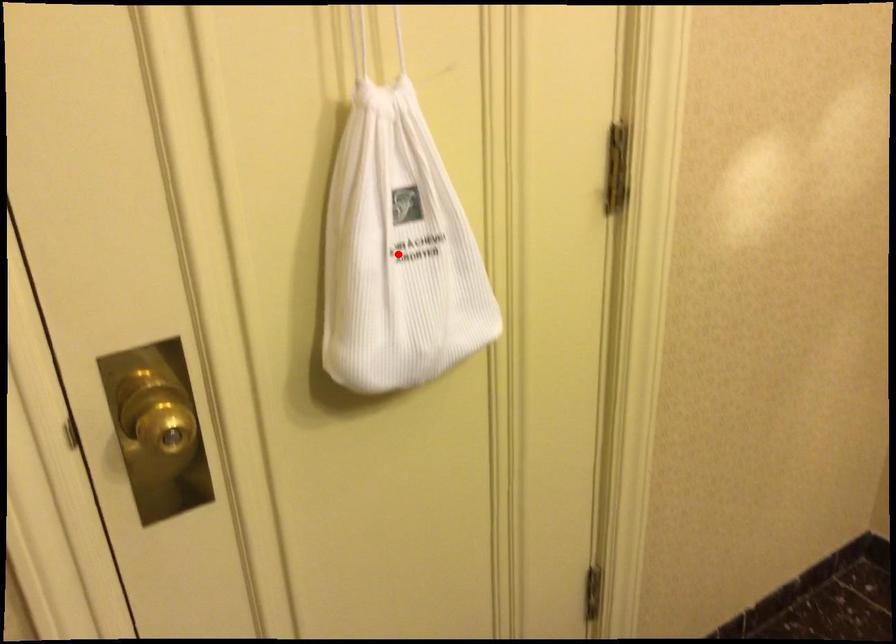
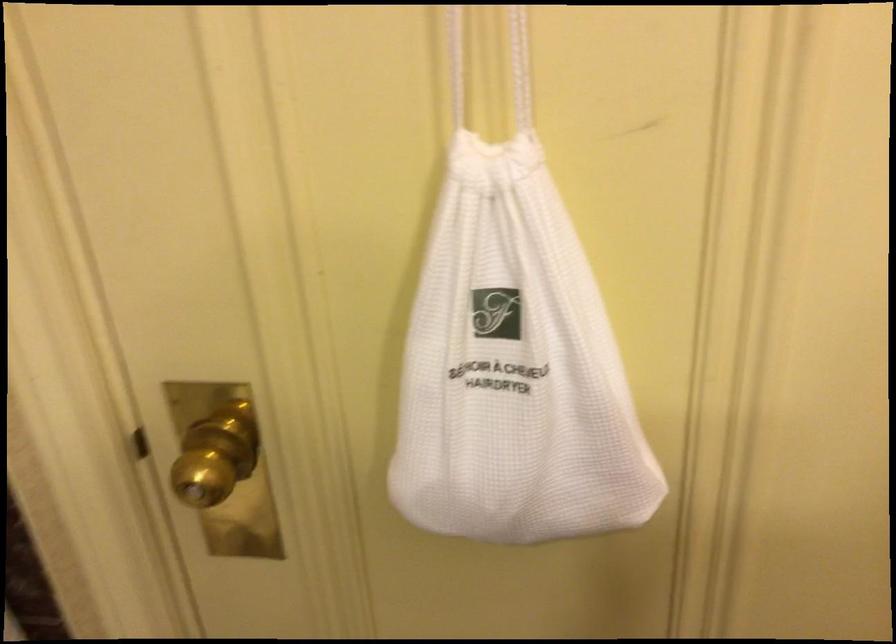
Question: I am providing you with two images of the same scene from different viewpoints. In image1, a red point is highlighted. Considering the same 3D point in image2, which of the following is correct?

Choices:
 (A) It is closer
 (B) It is farther

Answer: (A)